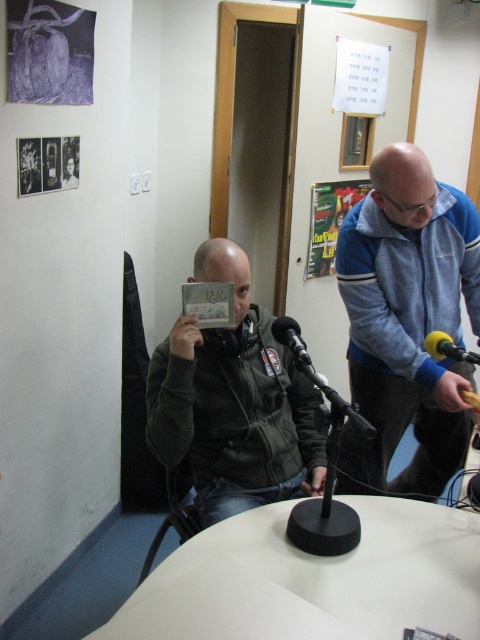
You are organizing a charity clothing drive and need to decide which jackets to pack first. The blue fleece jacket at upper right and the dark gray jacket at center are both available. Based on their sizes, which jacket can fit into a standard donation bag that can hold items up to 20 inches in width?

The blue fleece jacket at upper right has a width less than the dark gray jacket at center, so the blue fleece jacket at upper right can fit into the donation bag since it is narrower than the dark gray jacket at center.

You are setting up a microphone stand on the white matte table at center. The dark gray jacket at center is hanging nearby. Since the table is lower than the jacket, will the microphone be positioned higher or lower than the jacket?

The white matte table at center has a lesser height compared to dark gray jacket at center, so the microphone placed on the table will be positioned lower than the jacket.

You are a person who is 1.65 meters tall and standing in front of the blue fleece jacket at upper right. Can you comfortably reach the jacket without needing to stretch or jump?

The blue fleece jacket at upper right is 1.60 meters away from the viewer. Since the viewer is 1.65 meters tall, they can comfortably reach the jacket without stretching or jumping because the distance is within their arm reach.